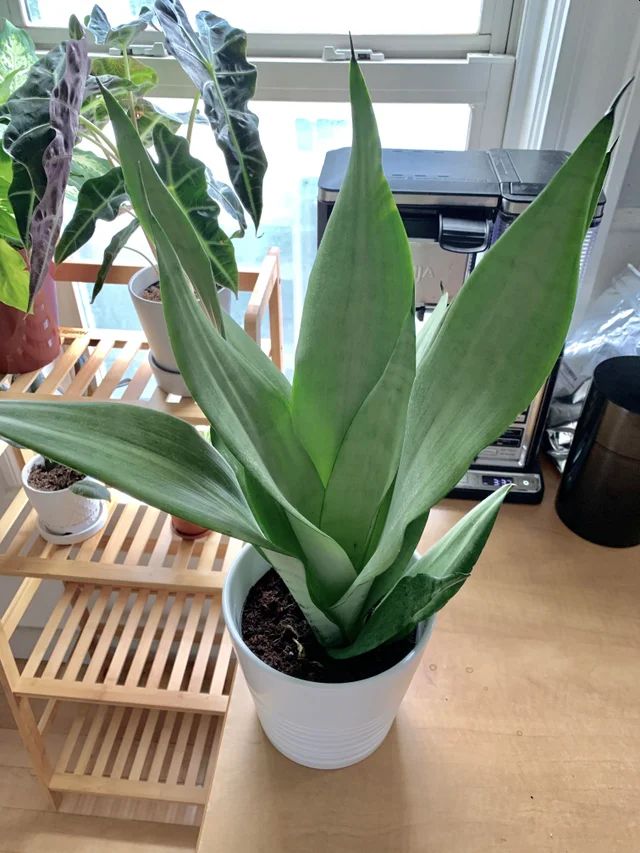
This screenshot has width=640, height=853. Identify the location of grey window frame. tap(481, 73).